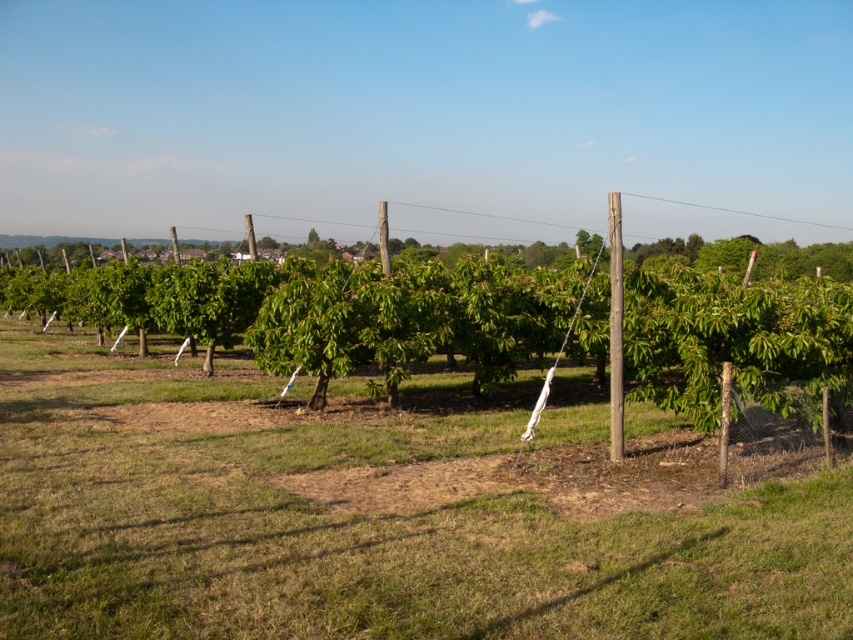
Question: Is green leafy tree at center behind smooth wooden pole at center?

Choices:
 (A) no
 (B) yes

Answer: (A)

Question: Which of the following is the farthest from the observer?

Choices:
 (A) (619, 225)
 (B) (814, 330)

Answer: (B)

Question: Does green leafy tree at center appear on the left side of smooth wooden pole at center?

Choices:
 (A) no
 (B) yes

Answer: (B)

Question: Observing the image, what is the correct spatial positioning of green leafy tree at center in reference to smooth wooden pole at center?

Choices:
 (A) left
 (B) right

Answer: (A)

Question: Which point is farther from the camera taking this photo?

Choices:
 (A) (86, 301)
 (B) (611, 337)

Answer: (A)

Question: Which point is farther to the camera?

Choices:
 (A) (485, 365)
 (B) (612, 362)

Answer: (A)